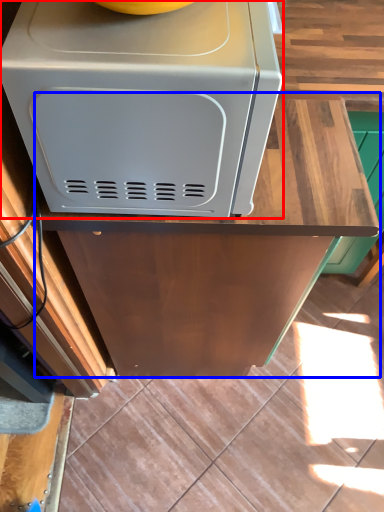
Question: Which object appears closest to the camera in this image, home appliance (highlighted by a red box) or counter (highlighted by a blue box)?

Choices:
 (A) home appliance
 (B) counter

Answer: (A)